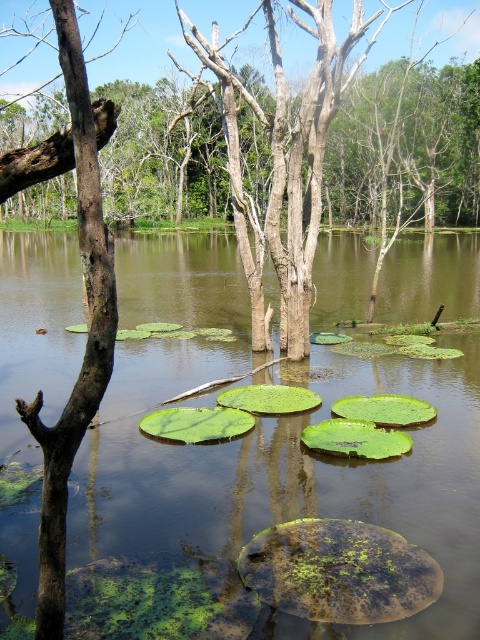
Is green leafy lily pads at center thinner than smooth brown tree trunk at left?

Incorrect, green leafy lily pads at center's width is not less than smooth brown tree trunk at left's.

Is the position of green leafy lily pads at center less distant than that of smooth brown tree trunk at left?

No, it is behind smooth brown tree trunk at left.

Is point (362, 294) behind point (69, 6)?

That is True.

This screenshot has height=640, width=480. In order to click on green leafy lily pads at center in this screenshot , I will do `click(300, 484)`.